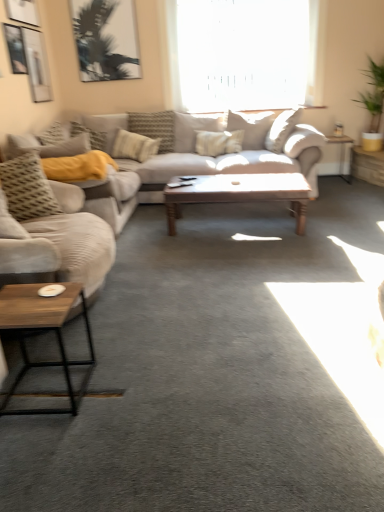
Question: From the image's perspective, is transparent glass window at upper center under metallic silver side table at right, the first table viewed from the left?

Choices:
 (A) no
 (B) yes

Answer: (A)

Question: From the image's perspective, would you say transparent glass window at upper center is positioned over metallic silver side table at right, marked as the 2th table in a right-to-left arrangement?

Choices:
 (A) yes
 (B) no

Answer: (A)

Question: Is transparent glass window at upper center oriented away from metallic silver side table at right, marked as the 2th table in a right-to-left arrangement?

Choices:
 (A) no
 (B) yes

Answer: (A)

Question: Is transparent glass window at upper center wider than metallic silver side table at right, the first table viewed from the left?

Choices:
 (A) no
 (B) yes

Answer: (A)

Question: Considering the relative sizes of transparent glass window at upper center and metallic silver side table at right, marked as the 2th table in a right-to-left arrangement, in the image provided, is transparent glass window at upper center taller than metallic silver side table at right, marked as the 2th table in a right-to-left arrangement,?

Choices:
 (A) no
 (B) yes

Answer: (B)

Question: Is wooden side table at right, which appears as the second table when viewed from the left, situated inside metallic silver picture frame at upper left or outside?

Choices:
 (A) outside
 (B) inside

Answer: (A)

Question: Considering the relative positions of wooden side table at right, which appears as the second table when viewed from the left, and metallic silver picture frame at upper left in the image provided, is wooden side table at right, which appears as the second table when viewed from the left, to the left or to the right of metallic silver picture frame at upper left?

Choices:
 (A) right
 (B) left

Answer: (A)

Question: From the image's perspective, is wooden side table at right, which appears as the second table when viewed from the left, located above or below metallic silver picture frame at upper left?

Choices:
 (A) above
 (B) below

Answer: (B)

Question: Is wooden side table at right, which appears as the second table when viewed from the left, in front of or behind metallic silver picture frame at upper left in the image?

Choices:
 (A) front
 (B) behind

Answer: (B)

Question: Would you say textured gray pillow at left, which is the second pillow in front-to-back order, is to the left or to the right of textured beige pillow at center, the 3th pillow in the front-to-back sequence, in the picture?

Choices:
 (A) right
 (B) left

Answer: (B)

Question: From a real-world perspective, relative to textured beige pillow at center, the 3th pillow in the front-to-back sequence, is textured gray pillow at left, which is the second pillow in front-to-back order, vertically above or below?

Choices:
 (A) below
 (B) above

Answer: (B)

Question: Considering the positions of point (49, 137) and point (127, 142), is point (49, 137) closer or farther from the camera than point (127, 142)?

Choices:
 (A) closer
 (B) farther

Answer: (A)

Question: From the image's perspective, is textured gray pillow at left, arranged as the fifth pillow when viewed from the right, located above or below textured beige pillow at center, the 3th pillow in the front-to-back sequence?

Choices:
 (A) above
 (B) below

Answer: (B)

Question: From their relative heights in the image, would you say textured gray pillow at left, the 4th pillow when ordered from right to left, is taller or shorter than wooden/metallic coffee table at lower left, which appears as the 2th coffee table when viewed from the top?

Choices:
 (A) tall
 (B) short

Answer: (A)

Question: From the image's perspective, relative to wooden/metallic coffee table at lower left, the first coffee table viewed from the front, is textured gray pillow at left, the fifth pillow from the back, above or below?

Choices:
 (A) below
 (B) above

Answer: (B)